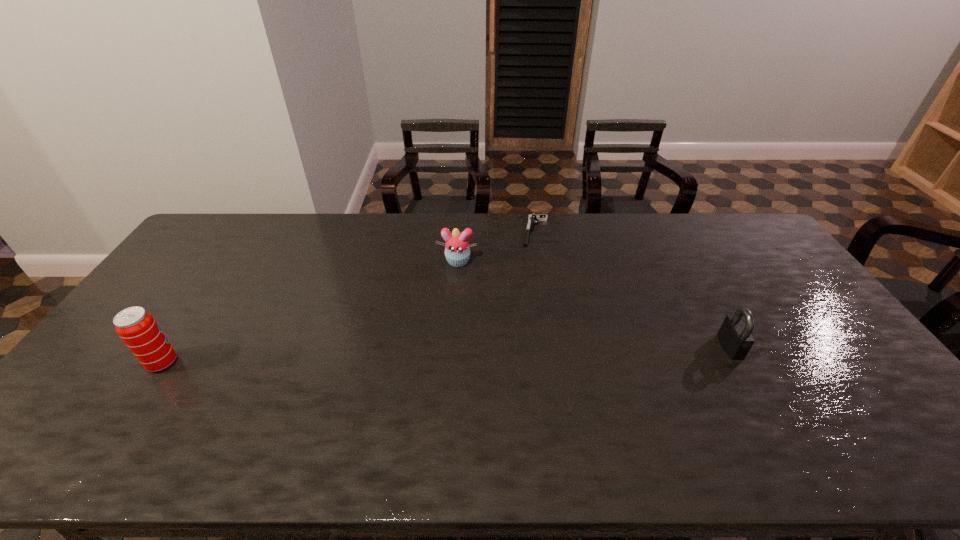
The width and height of the screenshot is (960, 540). What are the coordinates of `vacant space on the desktop that is between the tallest object and the padlock and is positioned on the face of the cupcake` in the screenshot? It's located at (435, 355).

Locate an element on the screen. vacant space on the desktop that is between the tallest object and the padlock and is positioned on the front-facing side of the third object from left to right is located at coordinates (516, 353).